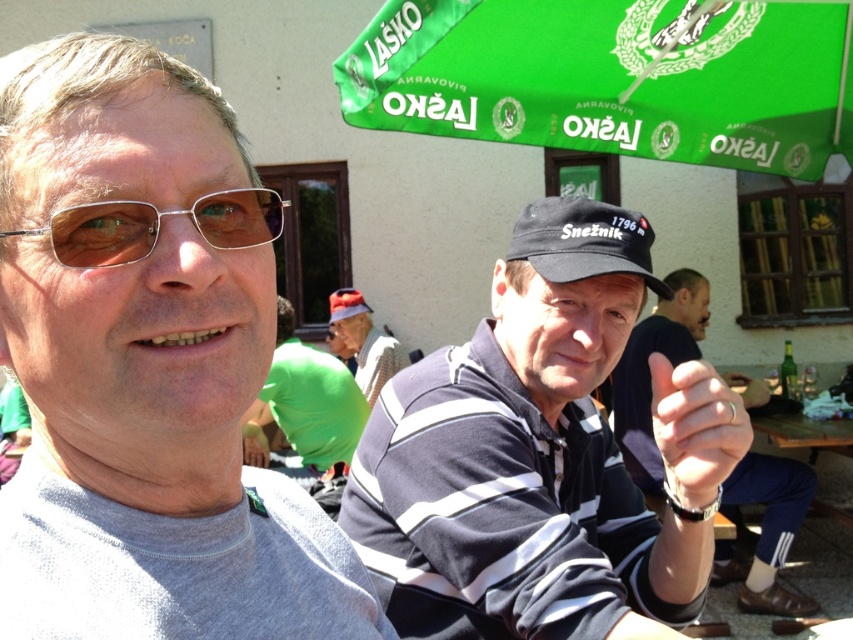
Question: Which is nearer to the metallic rectangular glasses at upper left?

Choices:
 (A) gold metallic ring at center
 (B) green fabric umbrella at upper center

Answer: (A)

Question: Can you confirm if gold metallic ring at center is bigger than plaid fabric shirt at center?

Choices:
 (A) no
 (B) yes

Answer: (A)

Question: Can you confirm if gray matte shirt at left is positioned to the right of black fabric cap at center?

Choices:
 (A) no
 (B) yes

Answer: (A)

Question: Which point is closer to the camera?

Choices:
 (A) red fabric baseball cap at center
 (B) green fabric cap at center
 (C) black fabric cap at center

Answer: (C)

Question: Which of the following is the farthest from the observer?

Choices:
 (A) (708, 422)
 (B) (328, 301)

Answer: (B)

Question: Can you confirm if gray matte shirt at left is positioned to the right of black matte cap at center?

Choices:
 (A) no
 (B) yes

Answer: (A)